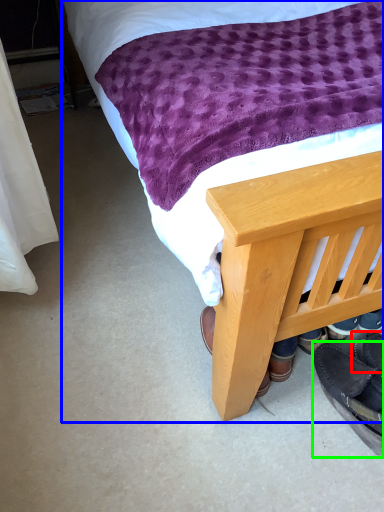
Question: Which object is the farthest from footwear (highlighted by a red box)? Choose among these: bed (highlighted by a blue box) or footwear (highlighted by a green box).

Choices:
 (A) bed
 (B) footwear

Answer: (A)